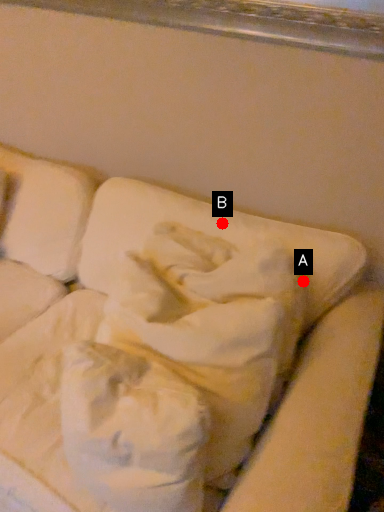
Question: Two points are circled on the image, labeled by A and B beside each circle. Which of the following is the closest to the observer?

Choices:
 (A) A is closer
 (B) B is closer

Answer: (A)